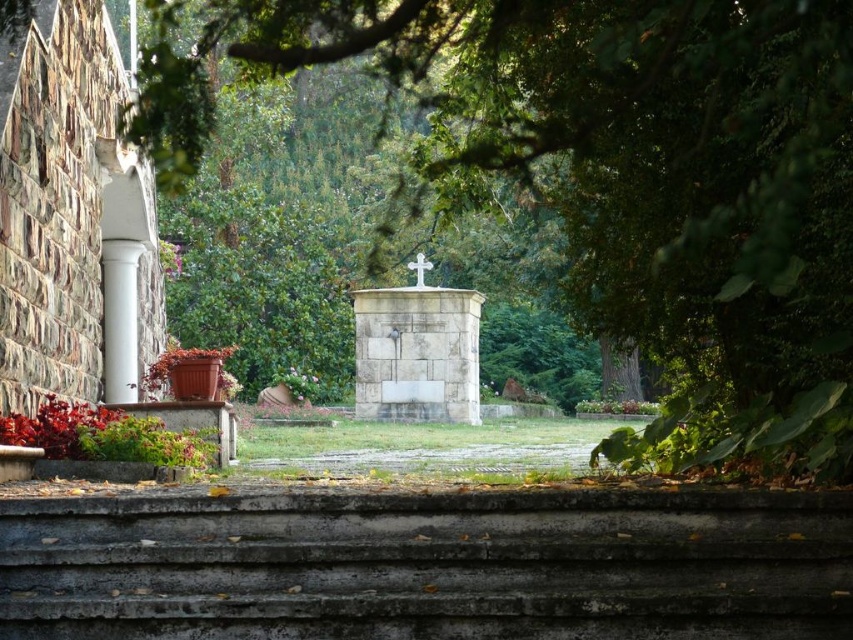
Question: Can you confirm if concrete steps at center is positioned to the left of white marble column at left?

Choices:
 (A) yes
 (B) no

Answer: (B)

Question: Which point appears farthest from the camera in this image?

Choices:
 (A) (109, 264)
 (B) (393, 618)

Answer: (A)

Question: Does green leafy tree at center appear under concrete steps at center?

Choices:
 (A) no
 (B) yes

Answer: (A)

Question: Is the position of concrete steps at center more distant than that of white marble column at left?

Choices:
 (A) no
 (B) yes

Answer: (A)

Question: Considering the real-world distances, which object is farthest from the concrete steps at center?

Choices:
 (A) green leafy tree at center
 (B) white marble column at left

Answer: (B)

Question: Which point is closer to the camera?

Choices:
 (A) (108, 257)
 (B) (425, 20)

Answer: (B)